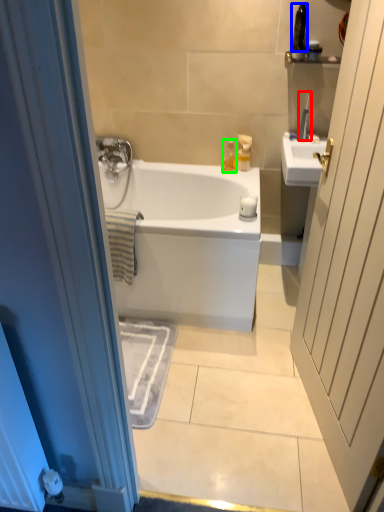
Question: Which object is the closest to the toiletry (highlighted by a red box)? Choose among these: toiletry (highlighted by a blue box) or toiletry (highlighted by a green box).

Choices:
 (A) toiletry
 (B) toiletry

Answer: (A)